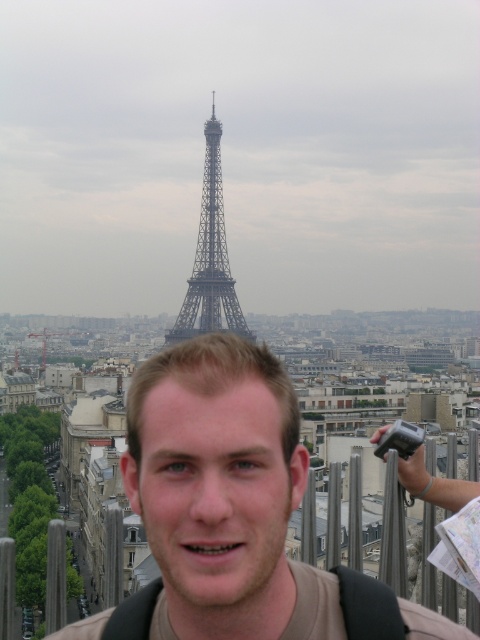
How far apart are brown matte shirt at center and metallic silver tower at center?

brown matte shirt at center and metallic silver tower at center are 1240.84 feet apart from each other.

Is point (232, 586) positioned before point (237, 330)?

Yes.

Locate an element on the screen. brown matte shirt at center is located at coordinates (218, 502).